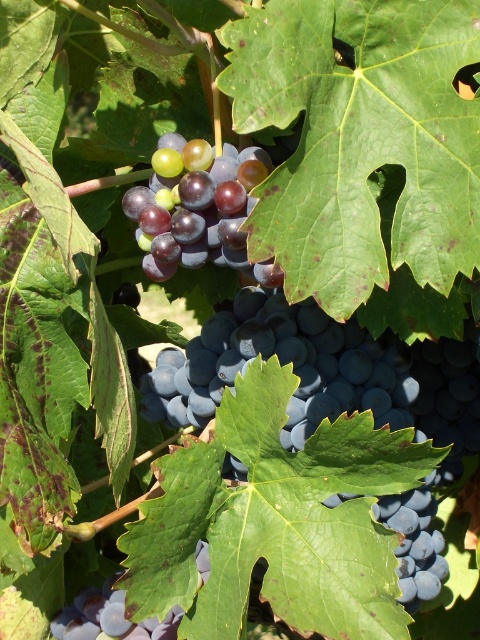
Question: Does shiny dark blue grapes at center appear on the right side of shiny purple grape at center?

Choices:
 (A) yes
 (B) no

Answer: (A)

Question: Which of the following is the closest to the observer?

Choices:
 (A) shiny purple grape at center
 (B) shiny dark blue grapes at center
 (C) shiny purple grapes at center

Answer: (C)

Question: Is shiny purple grapes at center thinner than shiny purple grape at center?

Choices:
 (A) no
 (B) yes

Answer: (B)

Question: Where is shiny dark blue grapes at center located in relation to shiny purple grape at center in the image?

Choices:
 (A) below
 (B) above

Answer: (B)

Question: Based on their relative distances, which object is nearer to the shiny purple grape at center?

Choices:
 (A) shiny dark blue grapes at center
 (B) shiny purple grapes at center

Answer: (A)

Question: Which of the following is the farthest from the observer?

Choices:
 (A) 182,406
 (B) 79,630
 (C) 153,209

Answer: (A)